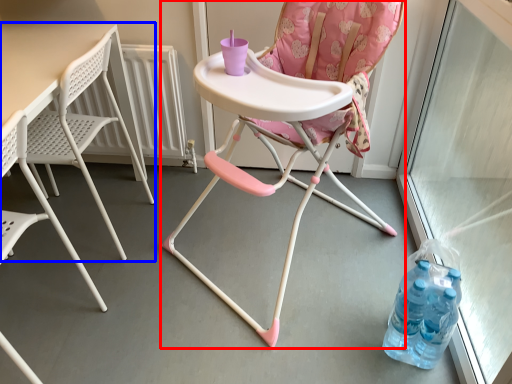
Question: Which point is closer to the camera, chair (highlighted by a red box) or table (highlighted by a blue box)?

Choices:
 (A) chair
 (B) table

Answer: (A)